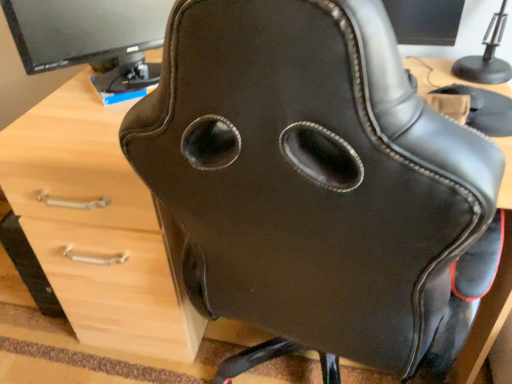
This screenshot has height=384, width=512. What do you see at coordinates (90, 36) in the screenshot?
I see `matte black monitor at upper left` at bounding box center [90, 36].

The image size is (512, 384). Find the location of `matte black monitor at upper left`. matte black monitor at upper left is located at coordinates (90, 36).

The width and height of the screenshot is (512, 384). In order to click on matte black monitor at upper left in this screenshot , I will do `click(90, 36)`.